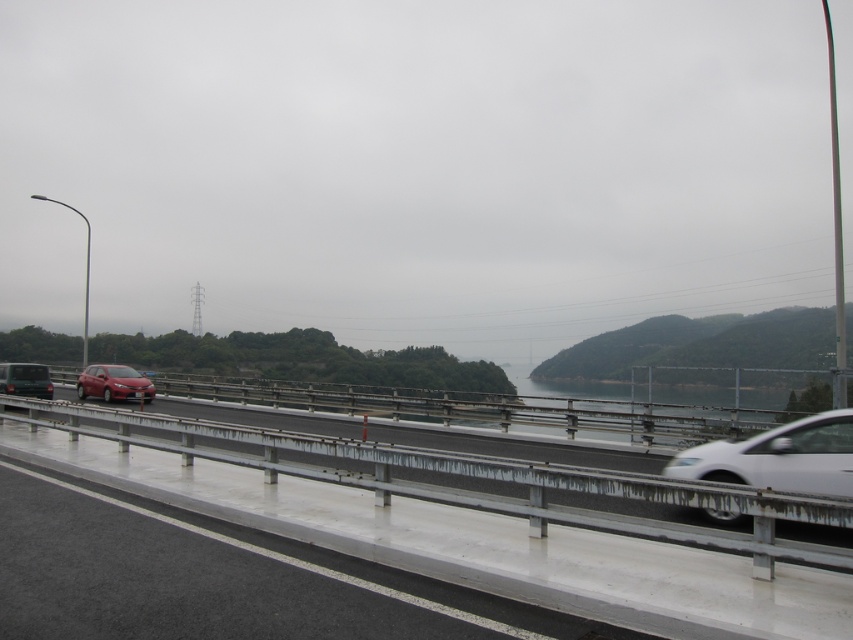
Which of these two, satin silver sedan at right or matte black car at left, stands taller?

matte black car at left is taller.

Can you confirm if satin silver sedan at right is positioned to the left of matte black car at left?

No, satin silver sedan at right is not to the left of matte black car at left.

Where is `satin silver sedan at right`? Image resolution: width=853 pixels, height=640 pixels. satin silver sedan at right is located at coordinates (778, 458).

Is shiny red sedan at center to the right of matte black car at left from the viewer's perspective?

Yes, shiny red sedan at center is to the right of matte black car at left.

Can you confirm if shiny red sedan at center is taller than matte black car at left?

Incorrect, shiny red sedan at center's height is not larger of matte black car at left's.

Where is `shiny red sedan at center`? shiny red sedan at center is located at coordinates (113, 384).

You are a GUI agent. You are given a task and a screenshot of the screen. Output one action in this format:
    pyautogui.click(x=<x>, y=<y>)
    Task: Click on the shiny red sedan at center
    
    Given the screenshot: What is the action you would take?
    pyautogui.click(x=113, y=384)

Is white concrete barrier at center taller than shiny red sedan at center?

No, white concrete barrier at center is not taller than shiny red sedan at center.

Does point (683, 577) come farther from viewer compared to point (105, 365)?

That is False.

Where is `white concrete barrier at center`? white concrete barrier at center is located at coordinates (476, 545).